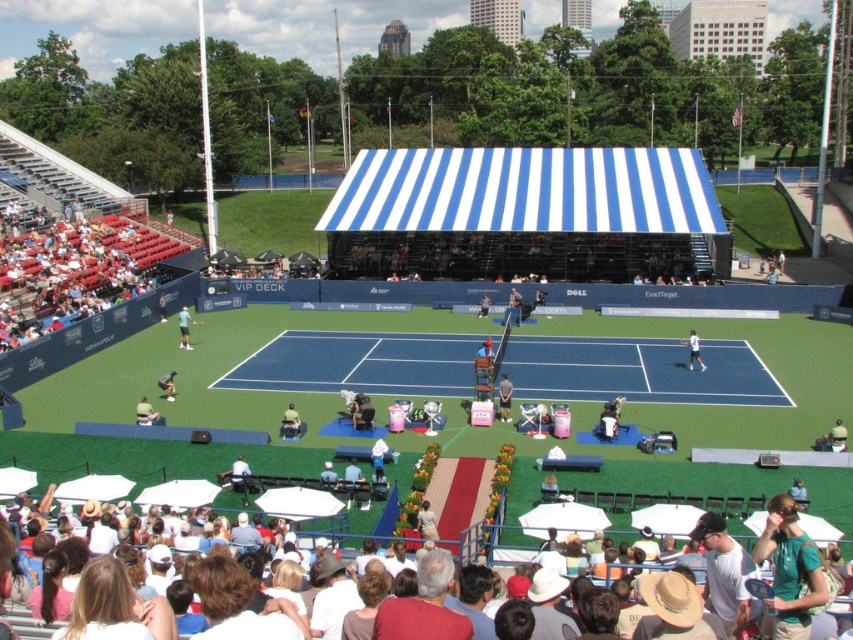
Question: Estimate the real-world distances between objects in this image. Which object is closer to the green fabric tennis racket at center?

Choices:
 (A) light brown leather tennis racket at center
 (B) blue/white striped canopy at center

Answer: (A)

Question: Which object is positioned farthest from the yellow-green shirt at center?

Choices:
 (A) green fabric tennis player at lower left
 (B) blue/white striped canopy at center
 (C) light brown straw hats at lower center

Answer: (B)

Question: Is blue/white striped canopy at center bigger than light brown leather jacket at center?

Choices:
 (A) no
 (B) yes

Answer: (B)

Question: Can you confirm if light brown leather tennis racket at center is positioned to the right of green fabric umbrella at lower right?

Choices:
 (A) yes
 (B) no

Answer: (B)

Question: Among these points, which one is farthest from the camera?

Choices:
 (A) (427, 532)
 (B) (184, 308)

Answer: (B)

Question: Does green fabric umbrella at lower right lie in front of green fabric tennis racket at center?

Choices:
 (A) no
 (B) yes

Answer: (B)